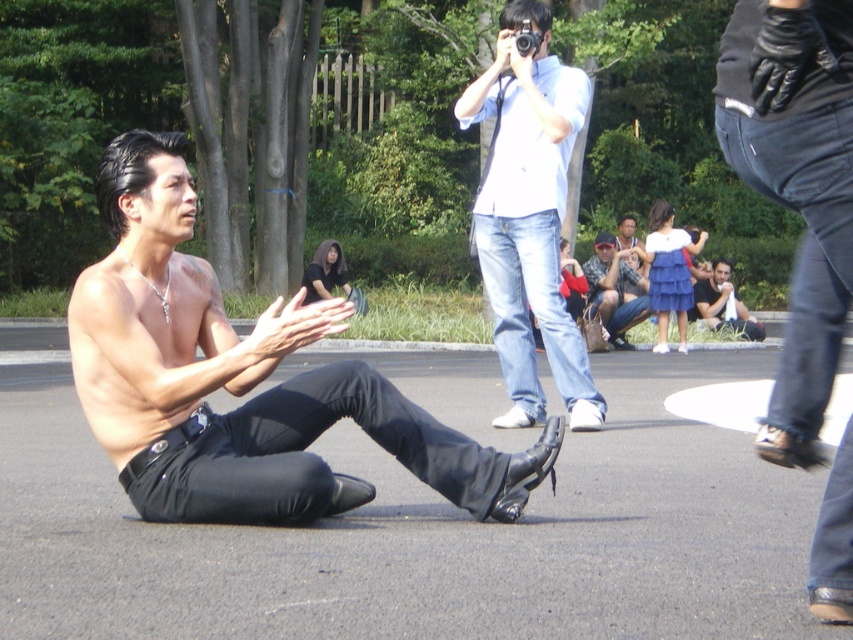
Question: Which point is closer to the camera?

Choices:
 (A) pyautogui.click(x=718, y=304)
 (B) pyautogui.click(x=524, y=305)

Answer: (B)

Question: Which of the following is the closest to the observer?

Choices:
 (A) (619, 228)
 (B) (621, 280)
 (C) (285, 449)
 (D) (724, 285)

Answer: (C)

Question: Estimate the real-world distances between objects in this image. Which object is closer to the shiny black pants at center?

Choices:
 (A) black cotton shirt at lower right
 (B) white cotton shirt at upper center
 (C) matte black shirt at center
 (D) matte blue jeans at center

Answer: (B)

Question: Is matte blue jeans at center thinner than black cotton shirt at lower right?

Choices:
 (A) yes
 (B) no

Answer: (A)

Question: Does white cotton shirt at upper center appear on the right side of matte blue jeans at center?

Choices:
 (A) yes
 (B) no

Answer: (B)

Question: Observing the image, what is the correct spatial positioning of shiny black pants at center in reference to matte black shirt at center?

Choices:
 (A) left
 (B) right

Answer: (A)